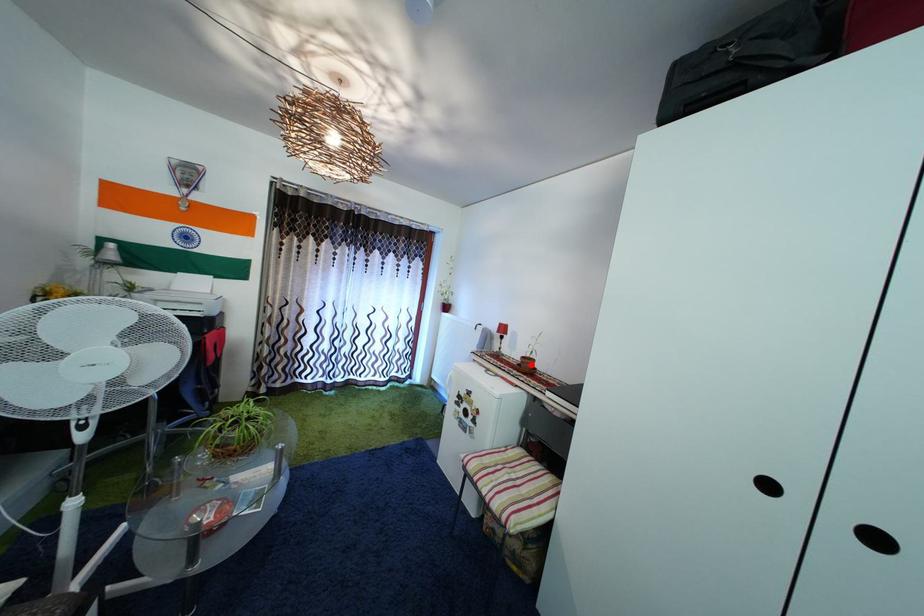
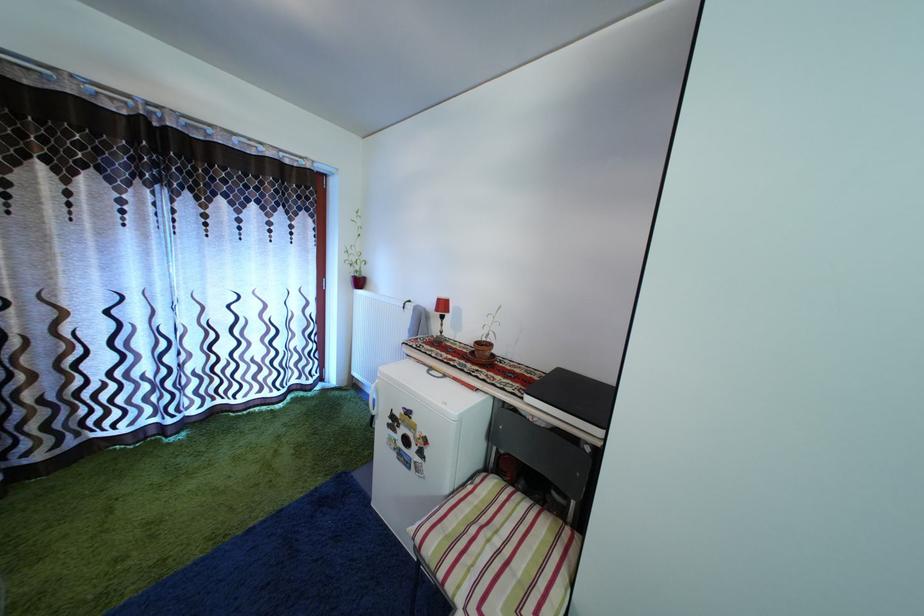
Locate, in the second image, the point that corresponds to the highlighted location in the first image.

(485, 350)